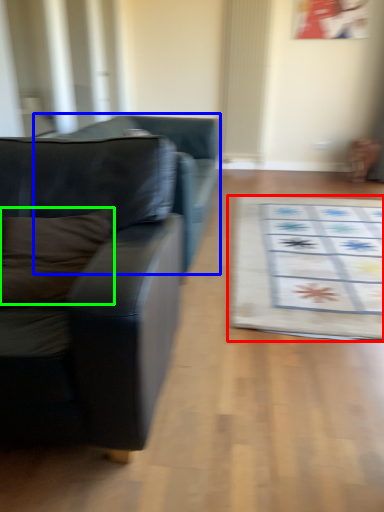
Question: Which object is positioned closest to mat (highlighted by a red box)? Select from studio couch (highlighted by a blue box) and pillow (highlighted by a green box).

Choices:
 (A) studio couch
 (B) pillow

Answer: (A)